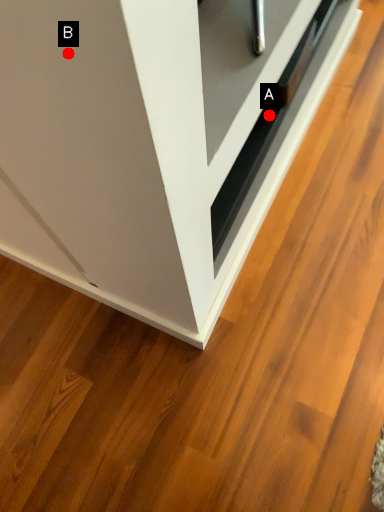
Question: Two points are circled on the image, labeled by A and B beside each circle. Which point is further to the camera?

Choices:
 (A) A is further
 (B) B is further

Answer: (A)